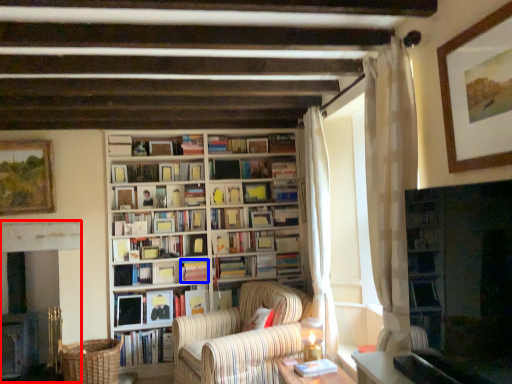
Question: Which object is closer to the camera taking this photo, fireplace (highlighted by a red box) or book (highlighted by a blue box)?

Choices:
 (A) fireplace
 (B) book

Answer: (A)